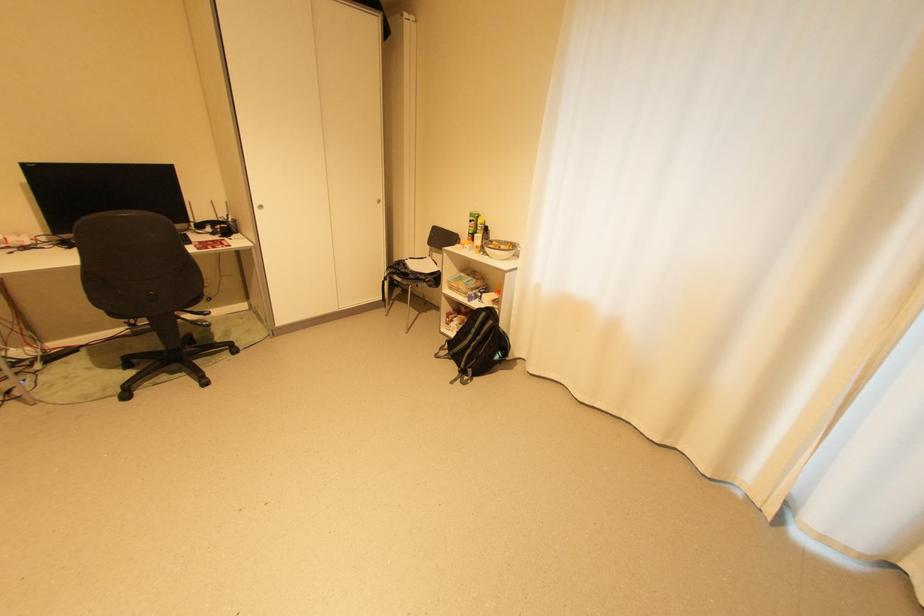
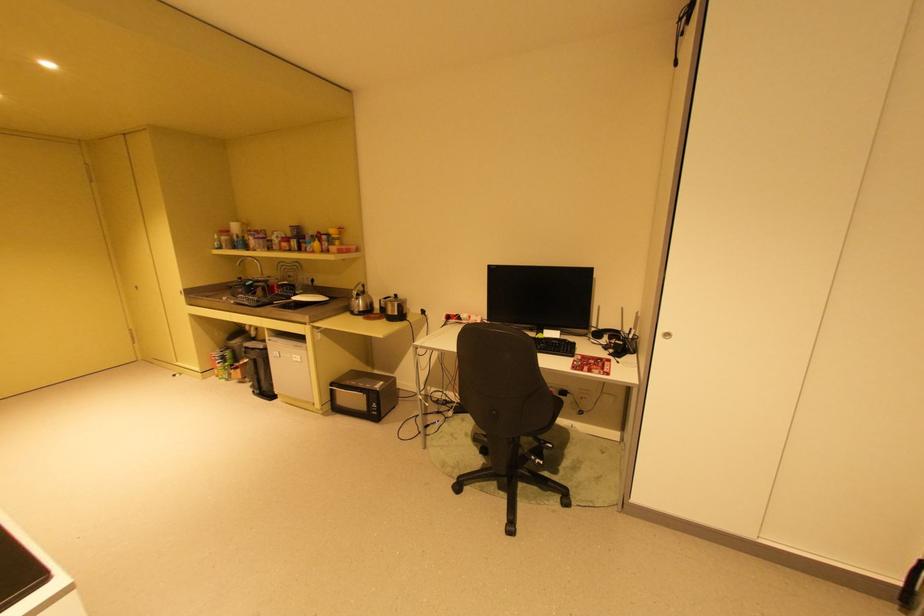
The point at (222, 233) is marked in the first image. Where is the corresponding point in the second image?

(614, 349)